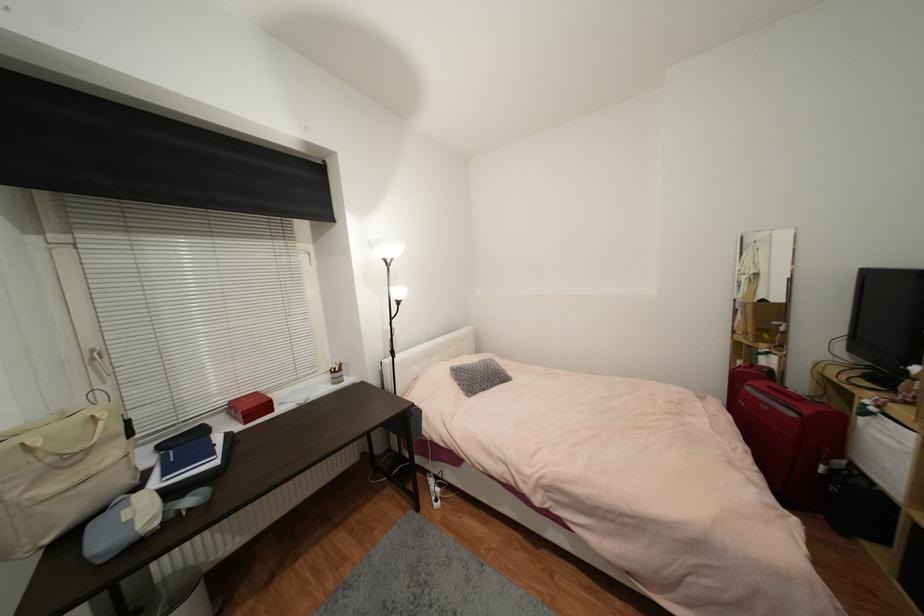
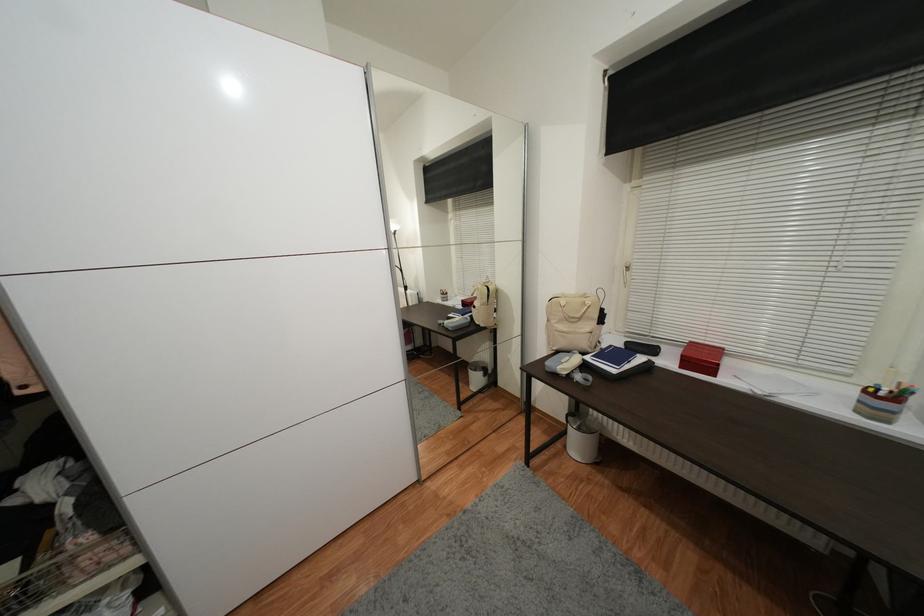
The point at (336,374) is marked in the first image. Where is the corresponding point in the second image?

(871, 392)